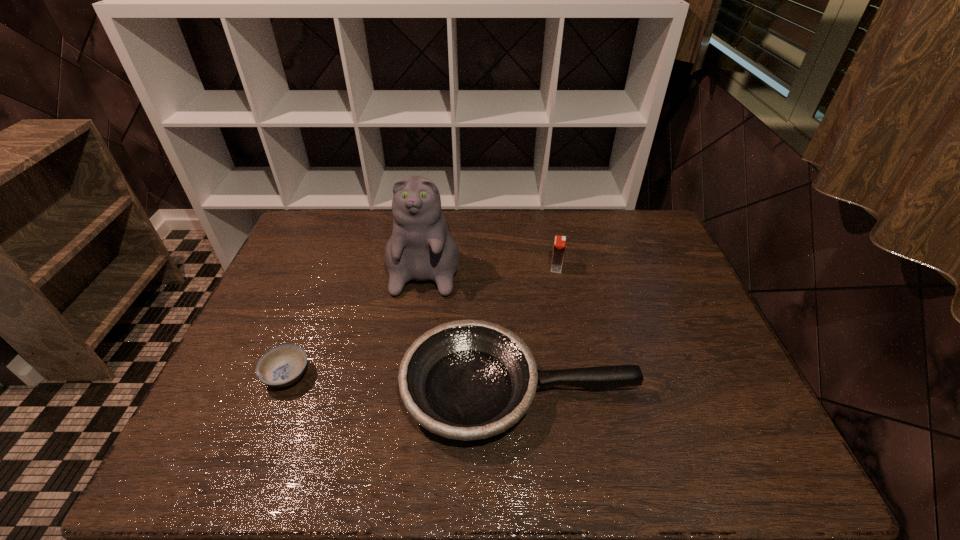
Identify the location of object present at the near edge. The image size is (960, 540). (466, 380).

The image size is (960, 540). I want to click on object located at the left edge, so click(283, 365).

The height and width of the screenshot is (540, 960). What are the coordinates of `free space at the far edge of the desktop` in the screenshot? It's located at (448, 212).

Where is `vacant space at the near edge`? vacant space at the near edge is located at coordinates (344, 442).

At what (x,y) coordinates should I click in order to perform the action: click on vacant space at the left edge of the desktop. Please return your answer as a coordinate pair (x, y). The width and height of the screenshot is (960, 540). Looking at the image, I should click on (272, 294).

Locate an element on the screen. Image resolution: width=960 pixels, height=540 pixels. free region at the right edge of the desktop is located at coordinates (693, 319).

Identify the location of vacant space at the far right corner of the desktop. (646, 228).

Find the location of a particular element. The height and width of the screenshot is (540, 960). vacant space at the near right corner of the desktop is located at coordinates (773, 457).

At what (x,y) coordinates should I click in order to perform the action: click on vacant point located between the orange juice and the bowl. Please return your answer as a coordinate pair (x, y). The height and width of the screenshot is (540, 960). Looking at the image, I should click on (421, 321).

Identify the location of vacant point located between the leftmost object and the cat. The height and width of the screenshot is (540, 960). (357, 315).